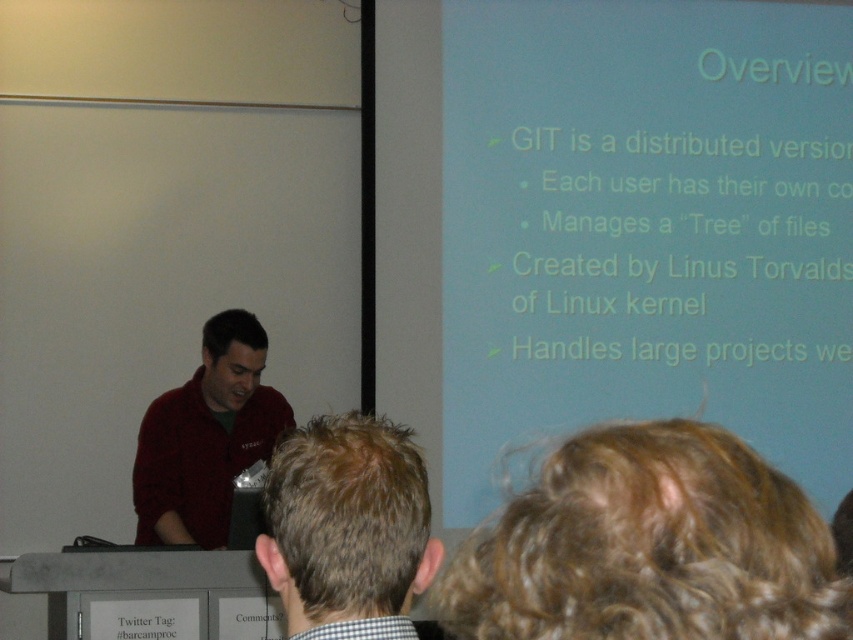
Question: In this image, where is brown hair at center located relative to matte red sweater at left?

Choices:
 (A) left
 (B) right

Answer: (B)

Question: Which point is farther to the camera?

Choices:
 (A) matte red sweater at left
 (B) brown hair at center

Answer: (A)

Question: Among these objects, which one is farthest from the camera?

Choices:
 (A) brown hair at center
 (B) matte red sweater at left

Answer: (B)

Question: From the image, what is the correct spatial relationship of brown hair at center in relation to matte red sweater at left?

Choices:
 (A) left
 (B) right

Answer: (B)

Question: Is brown hair at center below matte red sweater at left?

Choices:
 (A) yes
 (B) no

Answer: (B)